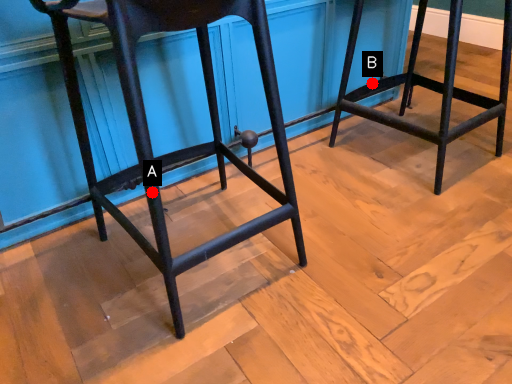
Question: Two points are circled on the image, labeled by A and B beside each circle. Which of the following is the farthest from the observer?

Choices:
 (A) A is further
 (B) B is further

Answer: (B)